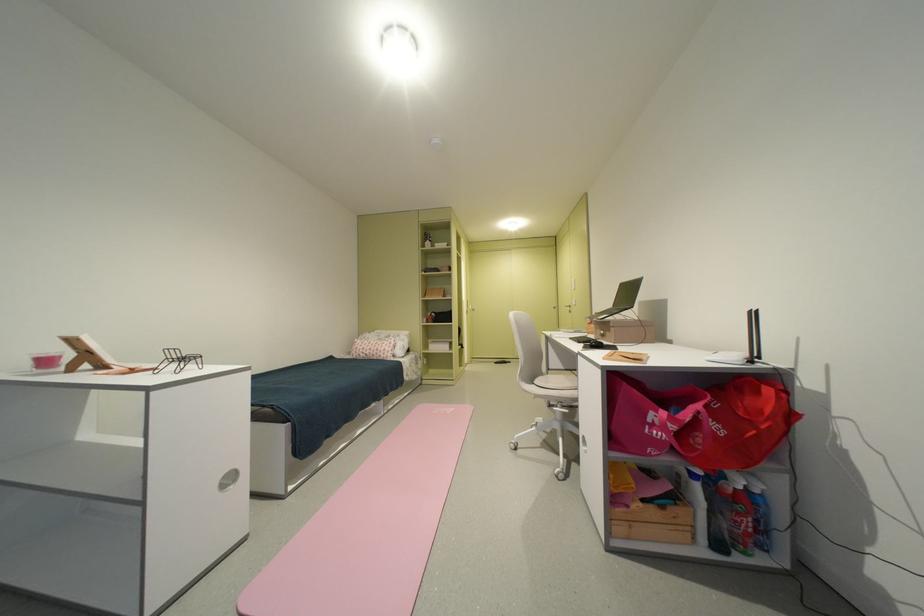
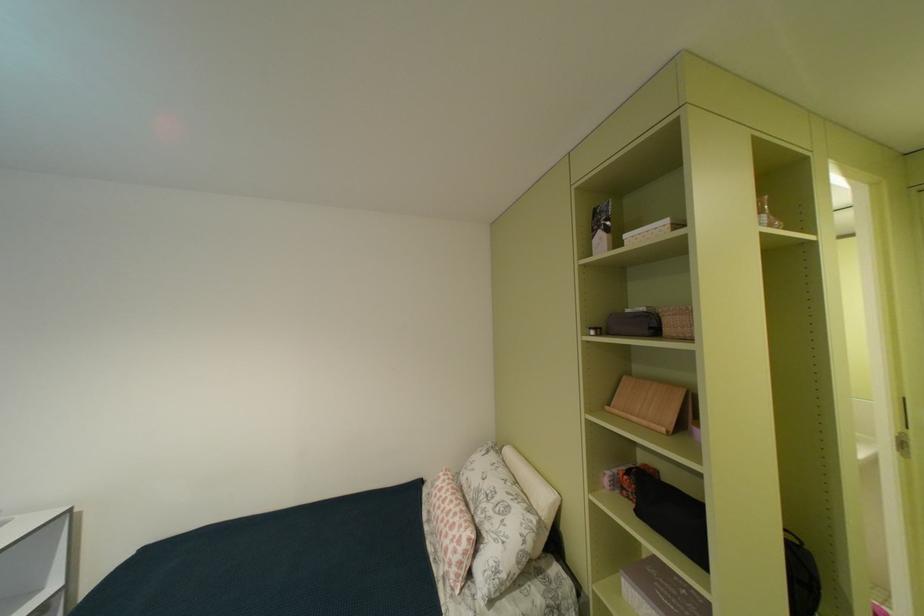
In the second image, find the point that corresponds to point (456, 245) in the first image.

(676, 223)